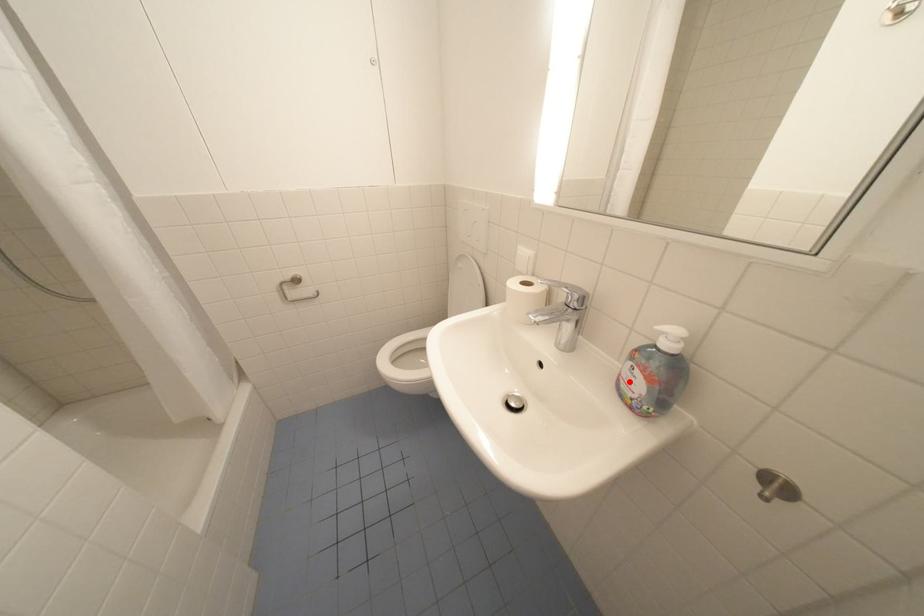
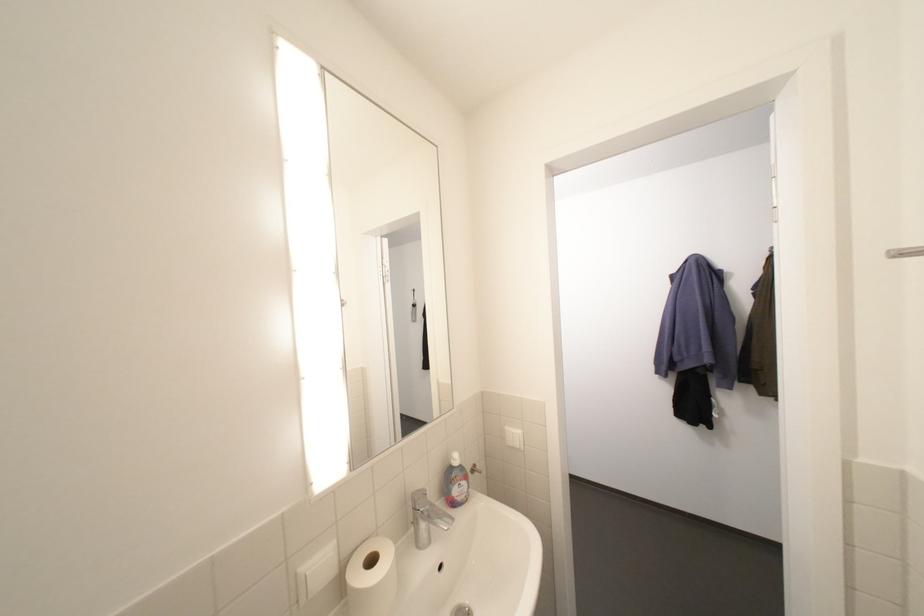
Locate, in the second image, the point that corresponds to the highlighted location in the first image.

(465, 499)